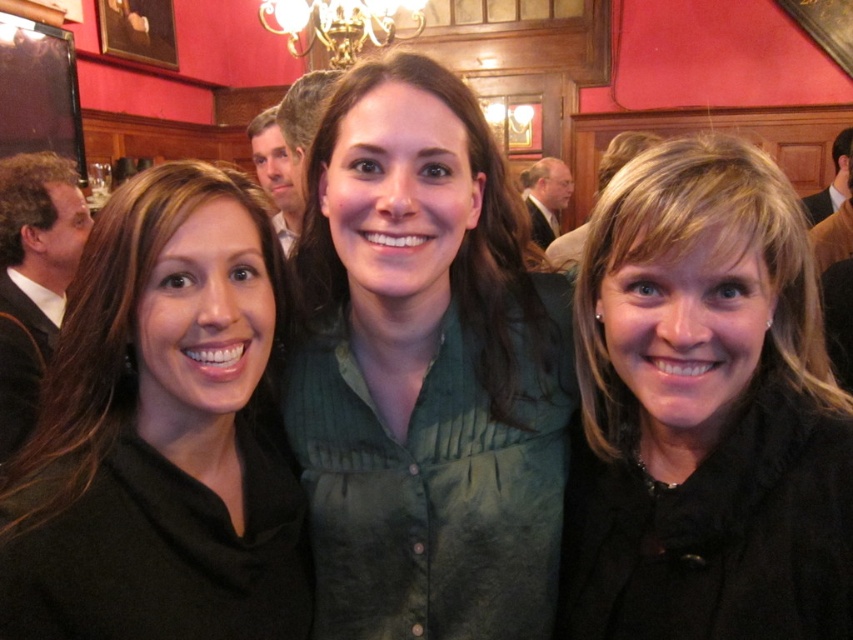
Question: Is green fabric shirt at center behind black matte shirt at center?

Choices:
 (A) yes
 (B) no

Answer: (A)

Question: Among these points, which one is farthest from the camera?

Choices:
 (A) (733, 492)
 (B) (13, 550)
 (C) (347, 28)
 (D) (381, 397)

Answer: (C)

Question: Which of the following is the farthest from the observer?

Choices:
 (A) gold metallic chandelier at upper center
 (B) black matte shirt at center
 (C) green fabric shirt at center
 (D) black matte jacket at right

Answer: (A)

Question: Can you confirm if black matte shirt at center is positioned below gold metallic chandelier at upper center?

Choices:
 (A) no
 (B) yes

Answer: (B)

Question: Which point is closer to the camera?

Choices:
 (A) (38, 522)
 (B) (338, 26)
 (C) (590, 314)
 (D) (345, 609)

Answer: (A)

Question: Is green fabric shirt at center to the left of black matte jacket at right from the viewer's perspective?

Choices:
 (A) yes
 (B) no

Answer: (A)